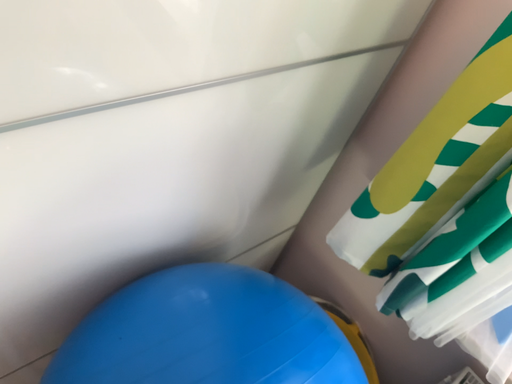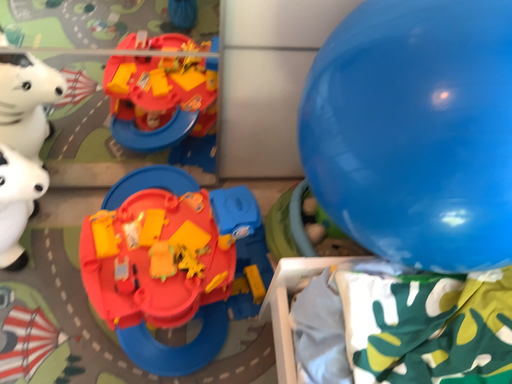
Question: Which way did the camera rotate in the video?

Choices:
 (A) rotated right
 (B) rotated left

Answer: (B)